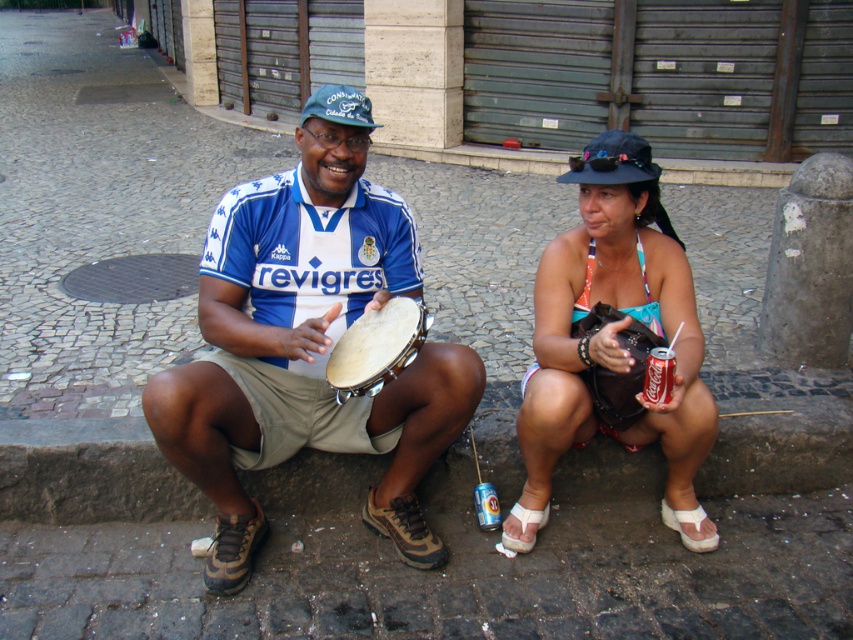
Who is taller, blue jersey tambourine at center or light brown leather drum at center?

With more height is blue jersey tambourine at center.

From the picture: Measure the distance between blue jersey tambourine at center and camera.

6.89 feet

Is point (224, 509) positioned before point (384, 307)?

No.

You are a GUI agent. You are given a task and a screenshot of the screen. Output one action in this format:
    pyautogui.click(x=<x>, y=<y>)
    Task: Click on the blue jersey tambourine at center
    This screenshot has width=853, height=640.
    Given the screenshot: What is the action you would take?
    pyautogui.click(x=306, y=342)

Who is positioned more to the left, white fabric sandal at lower right or white fabric sandal at lower center?

Positioned to the left is white fabric sandal at lower center.

Is white fabric sandal at lower right closer to the viewer compared to white fabric sandal at lower center?

No.

Identify the location of white fabric sandal at lower right. coord(688,522).

Which is behind, point (606, 163) or point (712, 532)?

Positioned behind is point (712, 532).

Which is more to the left, teal bikini top at center or white fabric sandal at lower right?

Positioned to the left is teal bikini top at center.

Which is in front, point (556, 428) or point (701, 515)?

Positioned in front is point (556, 428).

Where is `teal bikini top at center`? teal bikini top at center is located at coordinates (613, 328).